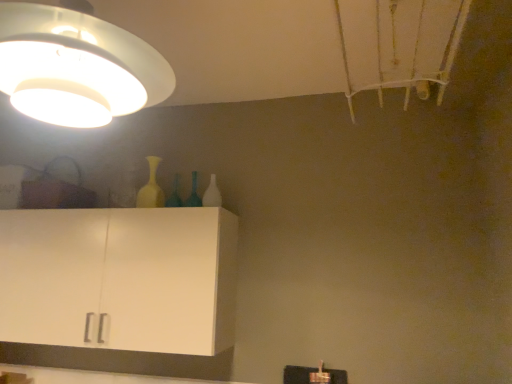
The image size is (512, 384). What do you see at coordinates (76, 66) in the screenshot? I see `white matte lampshade at upper left` at bounding box center [76, 66].

Locate an element on the screen. white matte lampshade at upper left is located at coordinates (76, 66).

Where is `white matte lampshade at upper left`? The image size is (512, 384). white matte lampshade at upper left is located at coordinates pyautogui.click(x=76, y=66).